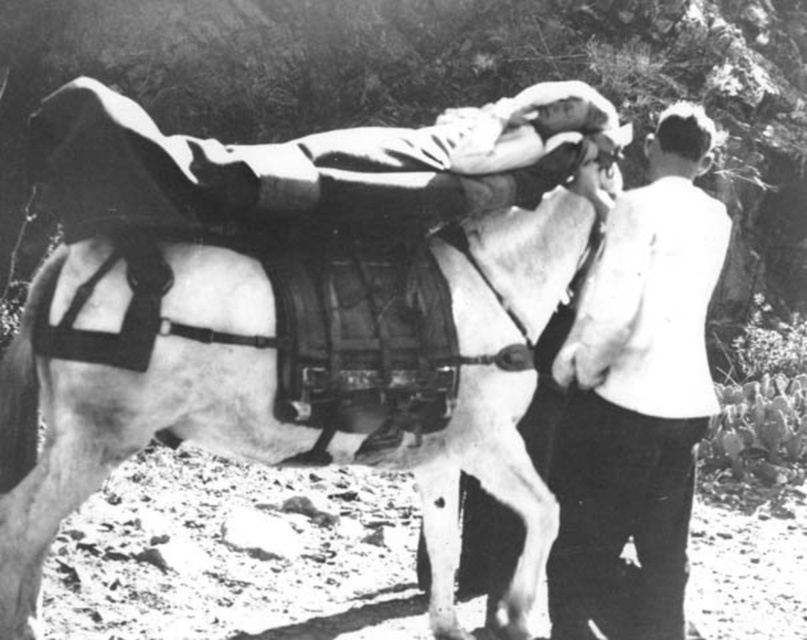
Question: Which object appears farthest from the camera in this image?

Choices:
 (A) white matte horse at center
 (B) smooth white shirt at right

Answer: (B)

Question: Which point is farther to the camera?

Choices:
 (A) (688, 376)
 (B) (3, 547)

Answer: (A)

Question: Can you confirm if white matte horse at center is positioned below smooth white shirt at right?

Choices:
 (A) no
 (B) yes

Answer: (A)

Question: Does white matte horse at center appear over smooth white shirt at right?

Choices:
 (A) no
 (B) yes

Answer: (B)

Question: Can you confirm if white matte horse at center is wider than smooth white shirt at right?

Choices:
 (A) no
 (B) yes

Answer: (B)